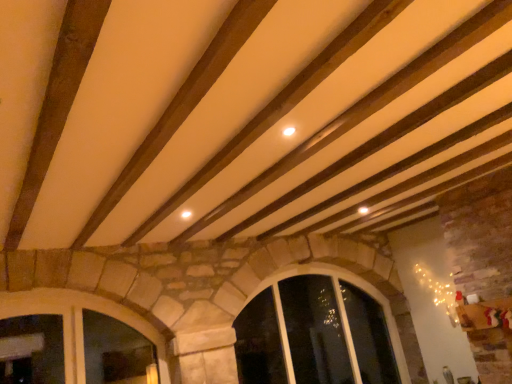
The height and width of the screenshot is (384, 512). In order to click on stone textured window at lower left, which is counted as the 1th window, starting from the front in this screenshot , I will do `click(80, 323)`.

This screenshot has height=384, width=512. What do you see at coordinates (80, 323) in the screenshot?
I see `stone textured window at lower left, which is counted as the 1th window, starting from the front` at bounding box center [80, 323].

What is the approximate width of stone textured window at lower left, positioned as the 2th window in right-to-left order?

The width of stone textured window at lower left, positioned as the 2th window in right-to-left order, is 11.79 inches.

How much space does clear glass window at center, acting as the second window starting from the front, occupy horizontally?

49.65 centimeters.

Describe the element at coordinates (325, 330) in the screenshot. The height and width of the screenshot is (384, 512). I see `clear glass window at center, which is counted as the first window, starting from the back` at that location.

In order to click on clear glass window at center, acting as the second window starting from the front in this screenshot , I will do pyautogui.click(x=325, y=330).

Where is `stone textured window at lower left, which appears as the 2th window when viewed from the back`? The width and height of the screenshot is (512, 384). stone textured window at lower left, which appears as the 2th window when viewed from the back is located at coordinates (80, 323).

In the scene shown: Between clear glass window at center, which ranks as the first window in right-to-left order, and stone textured window at lower left, positioned as the 2th window in right-to-left order, which one appears on the right side from the viewer's perspective?

From the viewer's perspective, clear glass window at center, which ranks as the first window in right-to-left order, appears more on the right side.

Which is in front, clear glass window at center, which is counted as the first window, starting from the back, or stone textured window at lower left, positioned as the 2th window in right-to-left order?

Positioned in front is stone textured window at lower left, positioned as the 2th window in right-to-left order.

Does point (328, 288) come closer to viewer compared to point (76, 379)?

That is False.

From the image's perspective, between clear glass window at center, which ranks as the first window in right-to-left order, and stone textured window at lower left, the first window in the left-to-right sequence, which one is located above?

stone textured window at lower left, the first window in the left-to-right sequence, appears higher in the image.

From a real-world perspective, is clear glass window at center, placed as the second window when sorted from left to right, physically above stone textured window at lower left, which is counted as the 1th window, starting from the front?

No, from a real-world perspective, clear glass window at center, placed as the second window when sorted from left to right, is not on top of stone textured window at lower left, which is counted as the 1th window, starting from the front.

Does clear glass window at center, placed as the second window when sorted from left to right, have a lesser width compared to stone textured window at lower left, positioned as the 2th window in right-to-left order?

No.

Is clear glass window at center, which ranks as the first window in right-to-left order, taller or shorter than stone textured window at lower left, the first window in the left-to-right sequence?

Considering their sizes, clear glass window at center, which ranks as the first window in right-to-left order, has more height than stone textured window at lower left, the first window in the left-to-right sequence.

Which of these two, clear glass window at center, placed as the second window when sorted from left to right, or stone textured window at lower left, which appears as the 2th window when viewed from the back, is bigger?

clear glass window at center, placed as the second window when sorted from left to right.

Is clear glass window at center, which ranks as the first window in right-to-left order, not within stone textured window at lower left, which appears as the 2th window when viewed from the back?

clear glass window at center, which ranks as the first window in right-to-left order, lies outside stone textured window at lower left, which appears as the 2th window when viewed from the back,'s area.

Is clear glass window at center, acting as the second window starting from the front, beside stone textured window at lower left, positioned as the 2th window in right-to-left order?

clear glass window at center, acting as the second window starting from the front, is not next to stone textured window at lower left, positioned as the 2th window in right-to-left order, and they're not touching.

Is clear glass window at center, which is counted as the first window, starting from the back, facing towards stone textured window at lower left, which is counted as the 1th window, starting from the front?

No, clear glass window at center, which is counted as the first window, starting from the back, is not oriented towards stone textured window at lower left, which is counted as the 1th window, starting from the front.

Looking at this image, how much distance is there between clear glass window at center, acting as the second window starting from the front, and stone textured window at lower left, the first window in the left-to-right sequence?

6.61 feet.

Find the location of `window located above the clear glass window at center, which is counted as the first window, starting from the back (from a real-world perspective)`. window located above the clear glass window at center, which is counted as the first window, starting from the back (from a real-world perspective) is located at coordinates [80, 323].

Visually, is stone textured window at lower left, which is counted as the 1th window, starting from the front, positioned to the left or to the right of clear glass window at center, acting as the second window starting from the front?

Clearly, stone textured window at lower left, which is counted as the 1th window, starting from the front, is on the left of clear glass window at center, acting as the second window starting from the front, in the image.

Relative to clear glass window at center, which ranks as the first window in right-to-left order, is stone textured window at lower left, which is counted as the 1th window, starting from the front, in front or behind?

stone textured window at lower left, which is counted as the 1th window, starting from the front, is in front of clear glass window at center, which ranks as the first window in right-to-left order.

Which point is more forward, (49, 290) or (404, 363)?

The point (49, 290) is more forward.

From the image's perspective, which one is positioned higher, stone textured window at lower left, which appears as the 2th window when viewed from the back, or clear glass window at center, acting as the second window starting from the front?

stone textured window at lower left, which appears as the 2th window when viewed from the back, from the image's perspective.

From a real-world perspective, is stone textured window at lower left, positioned as the 2th window in right-to-left order, positioned under clear glass window at center, placed as the second window when sorted from left to right, based on gravity?

Incorrect, from a real-world perspective, stone textured window at lower left, positioned as the 2th window in right-to-left order, is higher than clear glass window at center, placed as the second window when sorted from left to right.

Does stone textured window at lower left, the first window in the left-to-right sequence, have a lesser width compared to clear glass window at center, which ranks as the first window in right-to-left order?

Indeed, stone textured window at lower left, the first window in the left-to-right sequence, has a lesser width compared to clear glass window at center, which ranks as the first window in right-to-left order.

Considering the relative sizes of stone textured window at lower left, the first window in the left-to-right sequence, and clear glass window at center, which ranks as the first window in right-to-left order, in the image provided, is stone textured window at lower left, the first window in the left-to-right sequence, shorter than clear glass window at center, which ranks as the first window in right-to-left order,?

Correct, stone textured window at lower left, the first window in the left-to-right sequence, is not as tall as clear glass window at center, which ranks as the first window in right-to-left order.

Who is smaller, stone textured window at lower left, which is counted as the 1th window, starting from the front, or clear glass window at center, which is counted as the first window, starting from the back?

Smaller between the two is stone textured window at lower left, which is counted as the 1th window, starting from the front.

Which is correct: stone textured window at lower left, which appears as the 2th window when viewed from the back, is inside clear glass window at center, acting as the second window starting from the front, or outside of it?

The correct answer is: outside.

From the picture: Are stone textured window at lower left, which appears as the 2th window when viewed from the back, and clear glass window at center, which ranks as the first window in right-to-left order, far apart?

That's right, there is a large distance between stone textured window at lower left, which appears as the 2th window when viewed from the back, and clear glass window at center, which ranks as the first window in right-to-left order.

Is stone textured window at lower left, which appears as the 2th window when viewed from the back, facing away from clear glass window at center, placed as the second window when sorted from left to right?

No, stone textured window at lower left, which appears as the 2th window when viewed from the back, is not facing away from clear glass window at center, placed as the second window when sorted from left to right.

What's the angular difference between stone textured window at lower left, positioned as the 2th window in right-to-left order, and clear glass window at center, which is counted as the first window, starting from the back,'s facing directions?

The angle between the facing direction of stone textured window at lower left, positioned as the 2th window in right-to-left order, and the facing direction of clear glass window at center, which is counted as the first window, starting from the back, is 1.28 degrees.

Could you measure the distance between stone textured window at lower left, the first window in the left-to-right sequence, and clear glass window at center, acting as the second window starting from the front?

stone textured window at lower left, the first window in the left-to-right sequence, is 6.61 feet from clear glass window at center, acting as the second window starting from the front.

The width and height of the screenshot is (512, 384). What are the coordinates of `window that is behind the stone textured window at lower left, which appears as the 2th window when viewed from the back` in the screenshot? It's located at (325, 330).

This screenshot has width=512, height=384. I want to click on window below the stone textured window at lower left, which is counted as the 1th window, starting from the front (from the image's perspective), so click(325, 330).

Where is `window that is on the right side of stone textured window at lower left, which is counted as the 1th window, starting from the front`? window that is on the right side of stone textured window at lower left, which is counted as the 1th window, starting from the front is located at coordinates (325, 330).